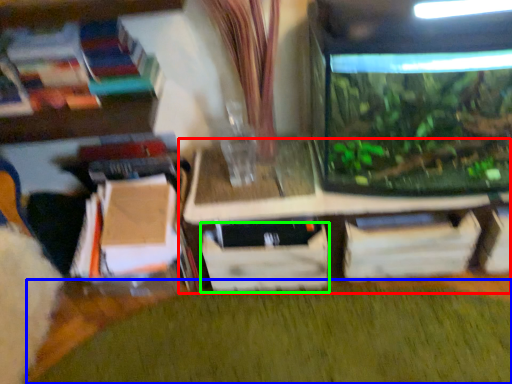
Question: Which object is the farthest from table (highlighted by a red box)? Choose among these: plant (highlighted by a blue box) or drawer (highlighted by a green box).

Choices:
 (A) plant
 (B) drawer

Answer: (A)